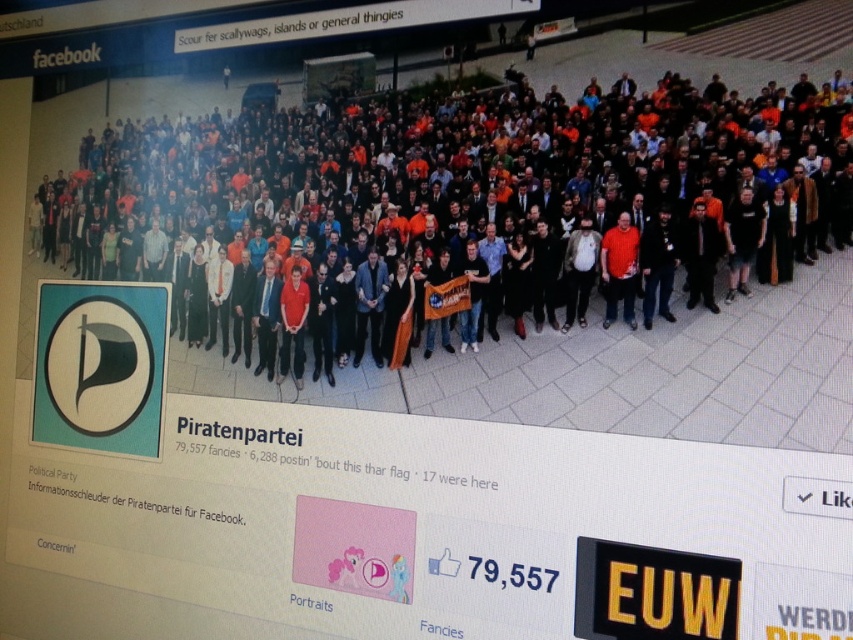
Does multicolored casual attire at center lie in front of matte orange shirt at center?

That is True.

The height and width of the screenshot is (640, 853). What do you see at coordinates (433, 188) in the screenshot?
I see `multicolored casual attire at center` at bounding box center [433, 188].

Is point (199, 227) less distant than point (625, 248)?

No, it is behind (625, 248).

The height and width of the screenshot is (640, 853). In order to click on multicolored casual attire at center in this screenshot , I will do `click(433, 188)`.

Who is shorter, multicolored casual attire at center or black text at upper center?

black text at upper center is shorter.

Does point (431, 196) come in front of point (234, 433)?

Yes, it is.

Is point (532, 275) positioned after point (219, 433)?

No.

Find the location of a particular element. This screenshot has width=853, height=640. multicolored casual attire at center is located at coordinates (433, 188).

Measure the distance between matte orange shirt at center and black text at upper center.

1.40 meters

Does point (611, 280) come closer to viewer compared to point (260, 440)?

That is True.

Identify the location of matte orange shirt at center. This screenshot has width=853, height=640. (619, 268).